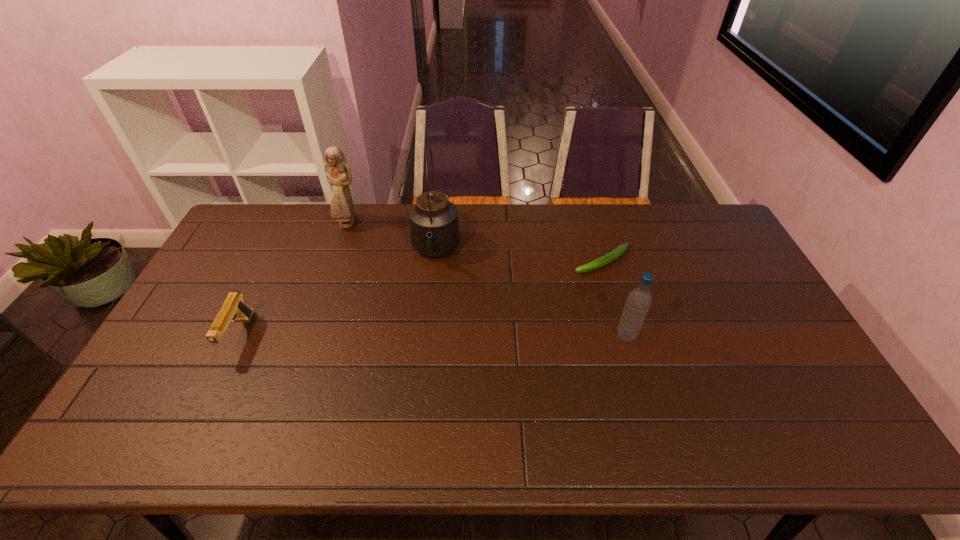
Identify the location of blank region between the zucchini and the second shortest object. pyautogui.click(x=420, y=298).

Identify the location of unoccupied area between the pistol and the water bottle. Image resolution: width=960 pixels, height=540 pixels. (433, 336).

The image size is (960, 540). I want to click on unoccupied position between the tallest object and the water bottle, so click(x=531, y=294).

Where is `vacant space that's between the third shortest object and the tallest object`? This screenshot has width=960, height=540. vacant space that's between the third shortest object and the tallest object is located at coordinates (531, 294).

What are the coordinates of `vacant region between the figurine and the water bottle` in the screenshot? It's located at (488, 280).

Find the location of `the fourth closest object to the third shortest object`. the fourth closest object to the third shortest object is located at coordinates (233, 308).

Identify which object is the closest to the water bottle. Please provide its 2D coordinates. Your answer should be formatted as a tuple, i.e. [(x, y)], where the tuple contains the x and y coordinates of a point satisfying the conditions above.

[(620, 250)]

Where is `vacant space that satisfies the following two spatial constraints: 1. on the front side of the fourth shortest object; 2. on the right side of the water bottle`? This screenshot has width=960, height=540. vacant space that satisfies the following two spatial constraints: 1. on the front side of the fourth shortest object; 2. on the right side of the water bottle is located at coordinates 310,336.

Identify the location of vacant region that satisfies the following two spatial constraints: 1. on the front side of the second object from left to right; 2. on the right side of the zucchini. (336, 261).